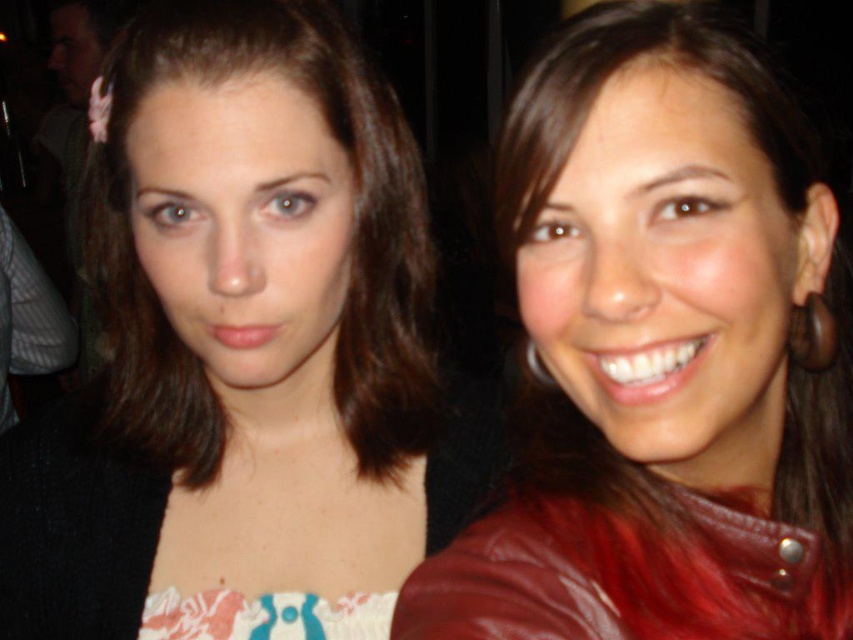
Question: Among these points, which one is nearest to the camera?

Choices:
 (A) (546, 524)
 (B) (120, 500)

Answer: (A)

Question: Is matte black hair at center closer to camera compared to red leather jacket at right?

Choices:
 (A) no
 (B) yes

Answer: (A)

Question: Where is matte black hair at center located in relation to red leather jacket at right in the image?

Choices:
 (A) right
 (B) left

Answer: (B)

Question: Which point is farther to the camera?

Choices:
 (A) red leather jacket at right
 (B) matte black hair at center

Answer: (B)

Question: Among these points, which one is farthest from the camera?

Choices:
 (A) (761, 120)
 (B) (381, 301)

Answer: (B)

Question: Can you confirm if matte black hair at center is positioned above red leather jacket at right?

Choices:
 (A) no
 (B) yes

Answer: (A)